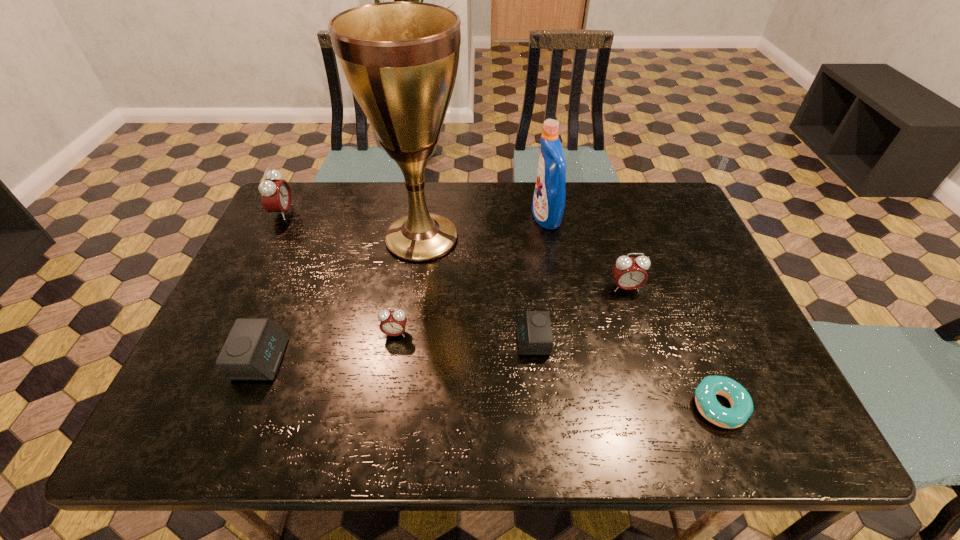
Image resolution: width=960 pixels, height=540 pixels. What are the coordinates of `vacant point located between the fourth tallest object and the smallest pink alarm clock` in the screenshot? It's located at (511, 310).

At what (x,y) coordinates should I click in order to perform the action: click on vacant space in between the smaller black alarm clock and the second object from right to left. Please return your answer as a coordinate pair (x, y). The image size is (960, 540). Looking at the image, I should click on (579, 314).

Image resolution: width=960 pixels, height=540 pixels. Find the location of `free space that is in between the right black alarm clock and the leftmost alarm clock`. free space that is in between the right black alarm clock and the leftmost alarm clock is located at coordinates (408, 276).

I want to click on free spot between the third alarm clock from right to left and the seventh tallest object, so click(464, 337).

Where is `free space between the shortest object and the third alarm clock from right to left`? This screenshot has width=960, height=540. free space between the shortest object and the third alarm clock from right to left is located at coordinates (557, 370).

Find the location of a particular element. The image size is (960, 540). vacant space that's between the right black alarm clock and the third object from right to left is located at coordinates (540, 279).

Where is `empty space between the fourth alarm clock from left to right and the farthest alarm clock`? The width and height of the screenshot is (960, 540). empty space between the fourth alarm clock from left to right and the farthest alarm clock is located at coordinates (408, 276).

Locate an element on the screen. The image size is (960, 540). vacant area that lies between the second farthest pink alarm clock and the smallest pink alarm clock is located at coordinates (511, 310).

The width and height of the screenshot is (960, 540). What are the coordinates of `blank region between the leftmost object and the rightmost object` in the screenshot? It's located at (501, 309).

The image size is (960, 540). In order to click on object that is the fifth nearest to the rightmost alarm clock in this screenshot , I will do `click(393, 323)`.